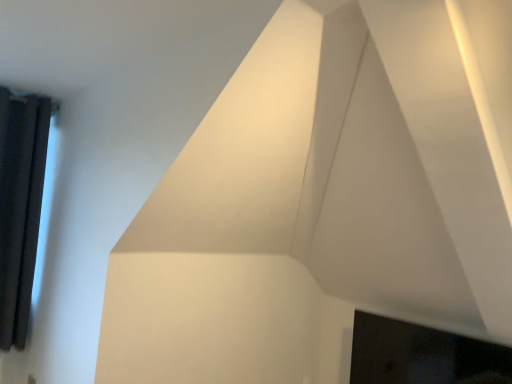
Describe the element at coordinates (20, 207) in the screenshot. I see `black curtain at left` at that location.

This screenshot has width=512, height=384. What are the coordinates of `black curtain at left` in the screenshot? It's located at (20, 207).

What is the approximate width of black glossy fireplace at lower right?

7.97 inches.

The image size is (512, 384). What are the coordinates of `black glossy fireplace at lower right` in the screenshot? It's located at (422, 355).

Measure the distance between black glossy fireplace at lower right and camera.

The distance of black glossy fireplace at lower right from camera is 2.30 meters.

Measure the distance between point (440, 362) and camera.

8.56 feet.

Describe the element at coordinates (422, 355) in the screenshot. This screenshot has width=512, height=384. I see `black glossy fireplace at lower right` at that location.

You are a GUI agent. You are given a task and a screenshot of the screen. Output one action in this format:
    pyautogui.click(x=<x>, y=<y>)
    Task: Click on the black curtain at left
    The width and height of the screenshot is (512, 384).
    Given the screenshot: What is the action you would take?
    pyautogui.click(x=20, y=207)

Is black curtain at left at the left side of black glossy fireplace at lower right?

Yes, black curtain at left is to the left of black glossy fireplace at lower right.

Is black curtain at left in front of black glossy fireplace at lower right?

No, it is behind black glossy fireplace at lower right.

Does point (35, 213) come closer to viewer compared to point (383, 317)?

No, it is behind (383, 317).

From the image's perspective, is black curtain at left over black glossy fireplace at lower right?

Yes.

Consider the image. From a real-world perspective, relative to black glossy fireplace at lower right, is black curtain at left vertically above or below?

From a real-world perspective, black curtain at left is physically above black glossy fireplace at lower right.

Considering the sizes of black curtain at left and black glossy fireplace at lower right in the image, is black curtain at left wider or thinner than black glossy fireplace at lower right?

In the image, black curtain at left appears to be more narrow than black glossy fireplace at lower right.

In the scene shown: Can you confirm if black curtain at left is taller than black glossy fireplace at lower right?

Correct, black curtain at left is much taller as black glossy fireplace at lower right.

In terms of size, does black curtain at left appear bigger or smaller than black glossy fireplace at lower right?

black curtain at left is smaller than black glossy fireplace at lower right.

Is black glossy fireplace at lower right surrounded by black curtain at left?

No, black glossy fireplace at lower right is not surrounded by black curtain at left.

Is black curtain at left far from black glossy fireplace at lower right?

That's right, there is a large distance between black curtain at left and black glossy fireplace at lower right.

Is black curtain at left turned away from black glossy fireplace at lower right?

No, black curtain at left is not facing the opposite direction of black glossy fireplace at lower right.

At what (x,y) coordinates should I click in order to perform the action: click on fireplace below the black curtain at left (from the image's perspective). Please return your answer as a coordinate pair (x, y). Looking at the image, I should click on (422, 355).

Visually, is black glossy fireplace at lower right positioned to the left or to the right of black curtain at left?

black glossy fireplace at lower right is to the right of black curtain at left.

Which object is further away from the camera taking this photo, black glossy fireplace at lower right or black curtain at left?

black curtain at left is further from the camera.

Does point (453, 382) appear closer or farther from the camera than point (22, 319)?

Point (453, 382) is closer to the camera than point (22, 319).

From the image's perspective, is black glossy fireplace at lower right positioned above or below black curtain at left?

From the image's perspective, black glossy fireplace at lower right appears below black curtain at left.

Based on the photo, from a real-world perspective, does black glossy fireplace at lower right sit lower than black curtain at left?

Yes.

Considering the sizes of black glossy fireplace at lower right and black curtain at left in the image, is black glossy fireplace at lower right wider or thinner than black curtain at left?

Clearly, black glossy fireplace at lower right has more width compared to black curtain at left.

Between black glossy fireplace at lower right and black curtain at left, which one has less height?

black glossy fireplace at lower right.

Consider the image. Can you confirm if black glossy fireplace at lower right is bigger than black curtain at left?

Yes.

Is black glossy fireplace at lower right not within black curtain at left?

Yes, black glossy fireplace at lower right is located beyond the bounds of black curtain at left.

Is black glossy fireplace at lower right placed right next to black curtain at left?

No, black glossy fireplace at lower right is not next to black curtain at left.

Consider the image. Is black glossy fireplace at lower right looking in the opposite direction of black curtain at left?

No, black glossy fireplace at lower right is not facing away from black curtain at left.

What's the angular difference between black glossy fireplace at lower right and black curtain at left's facing directions?

black glossy fireplace at lower right and black curtain at left are facing 90.2 degrees away from each other.

At what (x,y) coordinates should I click in order to perform the action: click on window that appears behind the black glossy fireplace at lower right. Please return your answer as a coordinate pair (x, y). This screenshot has width=512, height=384. Looking at the image, I should click on (20, 207).

This screenshot has width=512, height=384. In order to click on fireplace below the black curtain at left (from a real-world perspective) in this screenshot , I will do `click(422, 355)`.

Locate an element on the screen. fireplace in front of the black curtain at left is located at coordinates (422, 355).